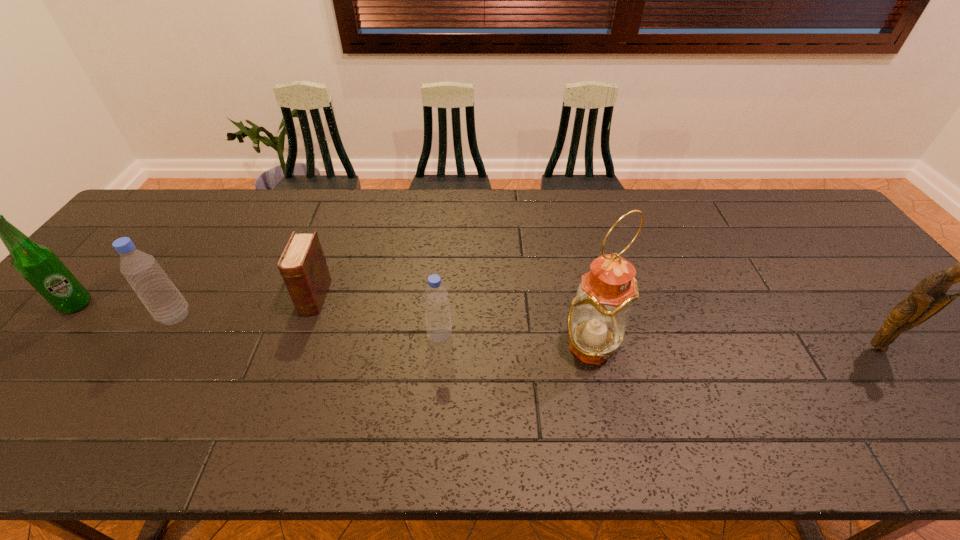
Locate an element on the screen. the left bottle is located at coordinates (165, 303).

This screenshot has height=540, width=960. Find the location of `the fifth object from right to left`. the fifth object from right to left is located at coordinates (165, 303).

The width and height of the screenshot is (960, 540). Find the location of `the right bottle`. the right bottle is located at coordinates (436, 300).

Where is `the third object from right to left`? Image resolution: width=960 pixels, height=540 pixels. the third object from right to left is located at coordinates (436, 300).

Find the location of a particular element. the fourth object from right to left is located at coordinates [x=302, y=265].

Identify the location of the shortest object. This screenshot has height=540, width=960. (302, 265).

Locate an element on the screen. beer bottle is located at coordinates (38, 264).

Where is `the rightmost object`? the rightmost object is located at coordinates (929, 297).

At what (x,y) coordinates should I click in order to perform the action: click on the second object from right to left. Please return your answer as a coordinate pair (x, y). This screenshot has width=960, height=540. Looking at the image, I should click on (599, 314).

The width and height of the screenshot is (960, 540). I want to click on the tallest object, so click(599, 314).